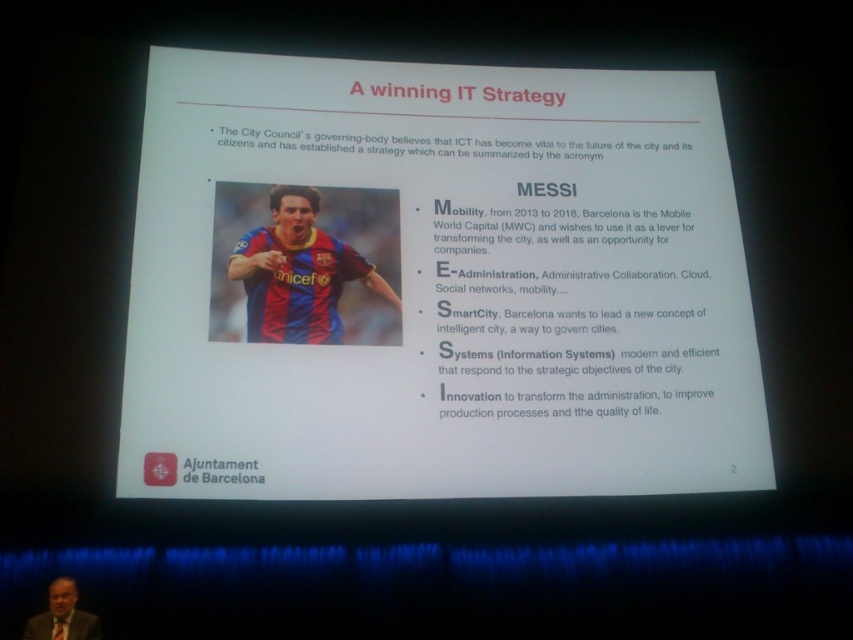
You are an event organizer at the conference. You need to place a 1.5 meter tall banner between the blue and red jersey at center and the matte black suit at lower left. Can the banner fit vertically between them?

The blue and red jersey at center is taller than the matte black suit at lower left. Since the banner is 1.5 meters tall, it can fit vertically between them as long as the vertical space between the two objects accommodates the banner height. However, the exact placement depends on the actual distance between their positions on the slide.

From the picture: You are an event organizer standing in front of the screen. You need to place a blue jersey at left on the stage. Where should you place it relative to the screen?

The blue jersey at left should be placed to the left side of the screen, as its 2D location on the slide is at point 0.445 on the x axis, which is the left side of the screen.